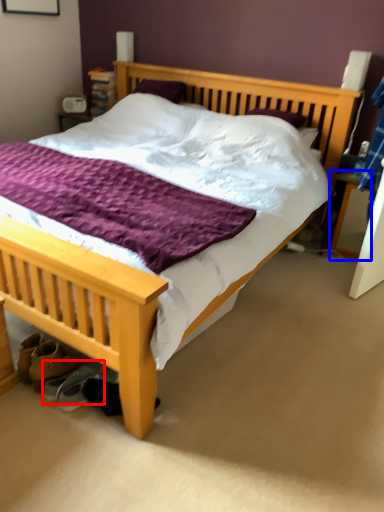
Question: Which object appears closest to the camera in this image, shoe (highlighted by a red box) or nightstand (highlighted by a blue box)?

Choices:
 (A) shoe
 (B) nightstand

Answer: (A)